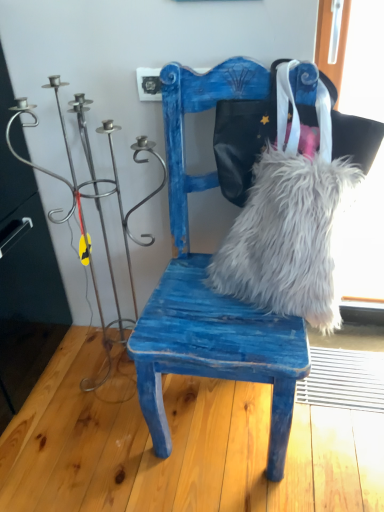
Question: From the image's perspective, is metallic wire candle holder at left under white fluffy fur at center?

Choices:
 (A) no
 (B) yes

Answer: (A)

Question: Considering the relative sizes of metallic wire candle holder at left and white fluffy fur at center in the image provided, is metallic wire candle holder at left taller than white fluffy fur at center?

Choices:
 (A) yes
 (B) no

Answer: (A)

Question: Is metallic wire candle holder at left bigger than white fluffy fur at center?

Choices:
 (A) no
 (B) yes

Answer: (B)

Question: Is metallic wire candle holder at left turned away from white fluffy fur at center?

Choices:
 (A) no
 (B) yes

Answer: (A)

Question: From a real-world perspective, is metallic wire candle holder at left below white fluffy fur at center?

Choices:
 (A) yes
 (B) no

Answer: (B)

Question: In terms of size, does white fluffy fur at center appear bigger or smaller than metallic wire candle holder at left?

Choices:
 (A) small
 (B) big

Answer: (A)

Question: From their relative heights in the image, would you say white fluffy fur at center is taller or shorter than metallic wire candle holder at left?

Choices:
 (A) tall
 (B) short

Answer: (B)

Question: Is point (317, 254) closer or farther from the camera than point (135, 153)?

Choices:
 (A) closer
 (B) farther

Answer: (A)

Question: In terms of width, does white fluffy fur at center look wider or thinner when compared to metallic wire candle holder at left?

Choices:
 (A) wide
 (B) thin

Answer: (B)

Question: Is metallic wire candle holder at left in front of or behind blue distressed wood chair at center in the image?

Choices:
 (A) front
 (B) behind

Answer: (B)

Question: Is metallic wire candle holder at left situated inside blue distressed wood chair at center or outside?

Choices:
 (A) inside
 (B) outside

Answer: (B)

Question: Considering the positions of metallic wire candle holder at left and blue distressed wood chair at center in the image, is metallic wire candle holder at left wider or thinner than blue distressed wood chair at center?

Choices:
 (A) wide
 (B) thin

Answer: (B)

Question: From the image's perspective, relative to blue distressed wood chair at center, is metallic wire candle holder at left above or below?

Choices:
 (A) below
 (B) above

Answer: (B)

Question: Is point (36, 119) positioned closer to the camera than point (223, 280)?

Choices:
 (A) farther
 (B) closer

Answer: (A)

Question: Is metallic wire candle holder at left spatially inside white fluffy fur at center, or outside of it?

Choices:
 (A) outside
 (B) inside

Answer: (A)